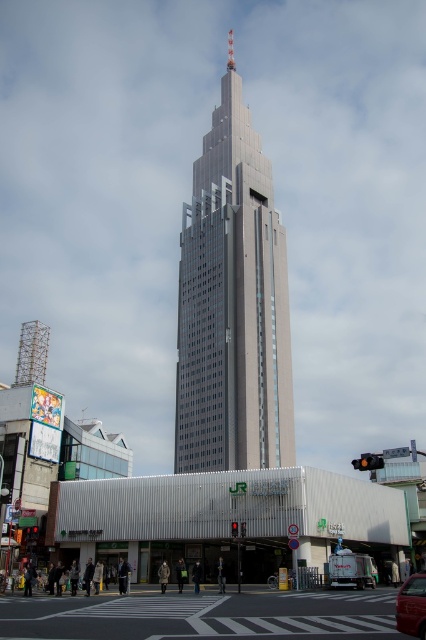
You are a pedestrian standing at the base of the skyscraper and want to cross the street to reach the train station. The white asphalt at center and the red glossy car at lower right are in your path. Which object is closer to you, and can you safely walk around it to reach the station?

The white asphalt at center is closer to you than the red glossy car at lower right. Since the asphalt is closer, you can safely walk around the red glossy car at lower right to reach the train station.